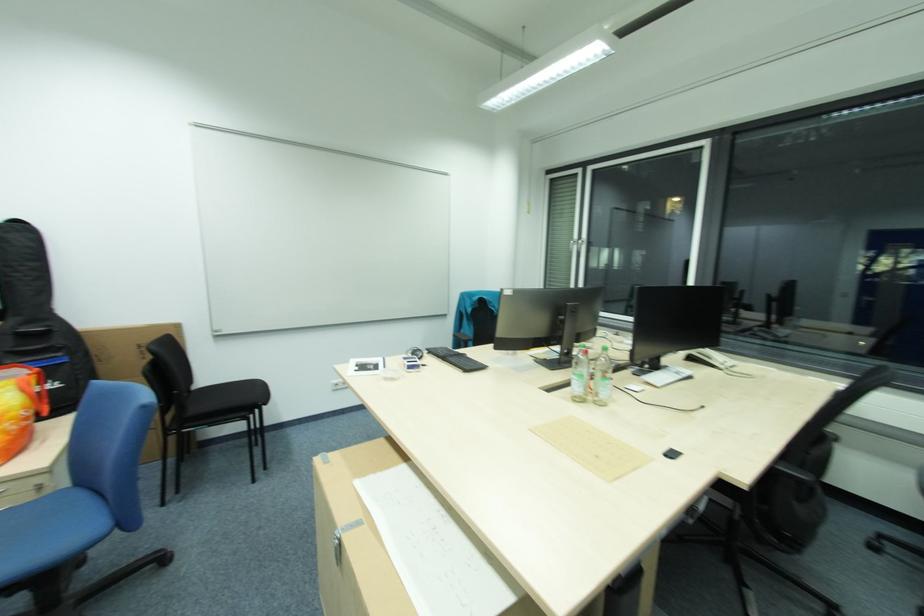
The height and width of the screenshot is (616, 924). What do you see at coordinates (225, 399) in the screenshot?
I see `a black chair sitting surface` at bounding box center [225, 399].